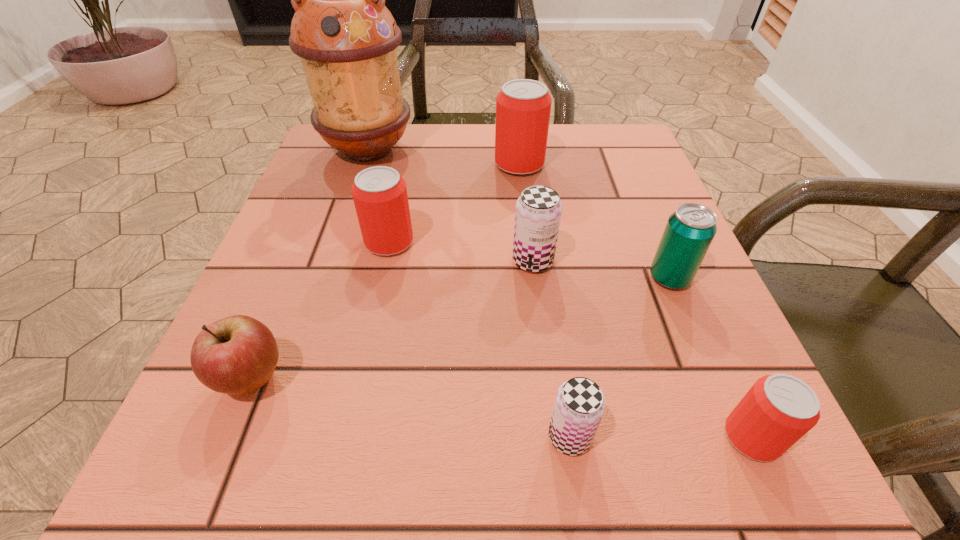
Where is `the smallest red beer can`? the smallest red beer can is located at coordinates (779, 409).

This screenshot has width=960, height=540. I want to click on the rightmost red beer can, so click(779, 409).

Find the location of `blank space located on the right of the tallest object`. blank space located on the right of the tallest object is located at coordinates (468, 150).

Find the location of a particular element. This screenshot has width=960, height=540. blank space located 0.110m on the right of the biggest red beer can is located at coordinates (595, 164).

Find the location of a particular element. The width and height of the screenshot is (960, 540). vacant region located on the right of the leftmost beer can is located at coordinates (556, 242).

At what (x,y) coordinates should I click in order to perform the action: click on vacant space located on the left of the bigger purple beer can. Please return your answer as a coordinate pair (x, y). This screenshot has width=960, height=540. Looking at the image, I should click on (435, 261).

Where is `free space located 0.380m on the back of the teal beer can`? The width and height of the screenshot is (960, 540). free space located 0.380m on the back of the teal beer can is located at coordinates (615, 147).

Where is `vacant area located 0.180m on the back of the red apple`? This screenshot has width=960, height=540. vacant area located 0.180m on the back of the red apple is located at coordinates (301, 260).

This screenshot has height=540, width=960. Find the location of `vacant space positioned 0.120m on the right of the smaller purple beer can`. vacant space positioned 0.120m on the right of the smaller purple beer can is located at coordinates (691, 436).

Image resolution: width=960 pixels, height=540 pixels. Find the location of `vacant space located 0.390m on the back of the smallest red beer can`. vacant space located 0.390m on the back of the smallest red beer can is located at coordinates (655, 218).